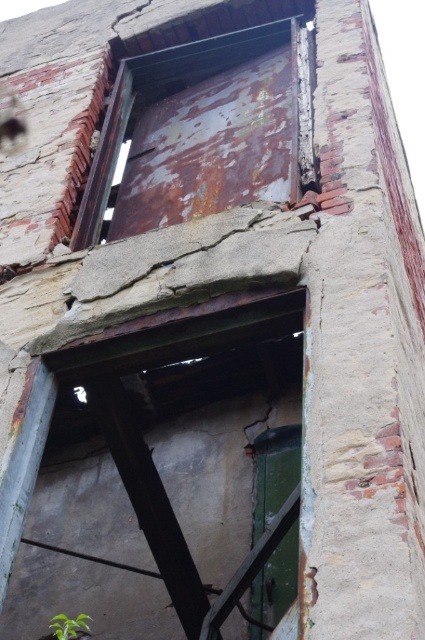
You are a maintenance worker standing at the entrance of the dilapidated building. You need to inspect both the rusty metal door at center and the rusty metal door at upper center. Which door is closer to you?

The rusty metal door at center is closer to you since it is only 7.64 meters away from the rusty metal door at upper center.

You are a maintenance worker inspecting the building. You notice two rusty metal doors. The first is the rusty metal door at center and the second is the rusty metal door at upper center. Which door is positioned to the right of the other?

The rusty metal door at center is positioned to the right of the rusty metal door at upper center.